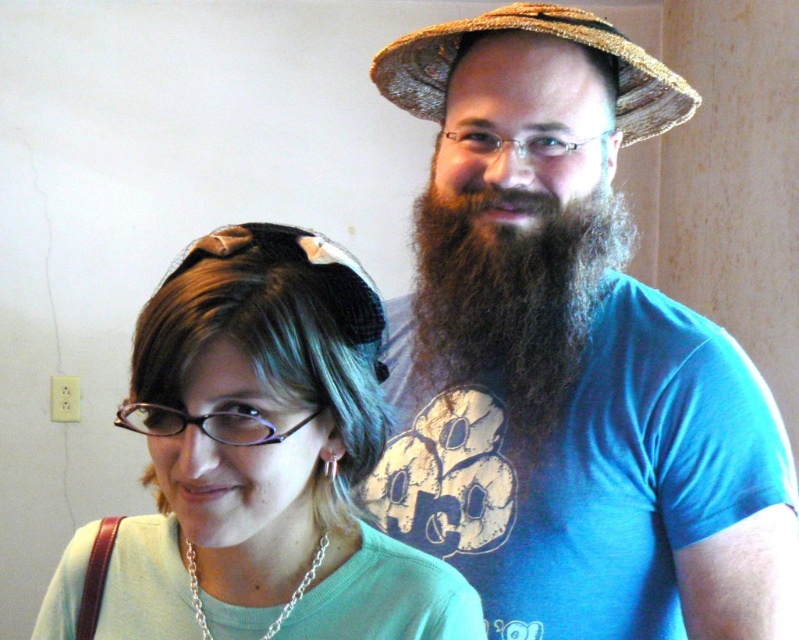
This screenshot has width=799, height=640. Describe the element at coordinates (569, 358) in the screenshot. I see `blue cotton t-shirt at center` at that location.

Is blue cotton t-shirt at center smaller than brown fuzzy beard at right?

No.

Find the location of a particular element. Image resolution: width=799 pixels, height=640 pixels. blue cotton t-shirt at center is located at coordinates (569, 358).

Is blue cotton t-shirt at center further to the viewer compared to green matte shirt at lower left?

Yes, blue cotton t-shirt at center is behind green matte shirt at lower left.

Is point (662, 582) more distant than point (346, 540)?

Yes.

Identify the location of blue cotton t-shirt at center. The image size is (799, 640). (569, 358).

Can you confirm if green matte shirt at lower left is positioned below woven straw hat at upper center?

Correct, green matte shirt at lower left is located below woven straw hat at upper center.

In the scene shown: Who is positioned more to the left, green matte shirt at lower left or woven straw hat at upper center?

green matte shirt at lower left

Image resolution: width=799 pixels, height=640 pixels. Describe the element at coordinates (265, 458) in the screenshot. I see `green matte shirt at lower left` at that location.

This screenshot has width=799, height=640. I want to click on green matte shirt at lower left, so click(265, 458).